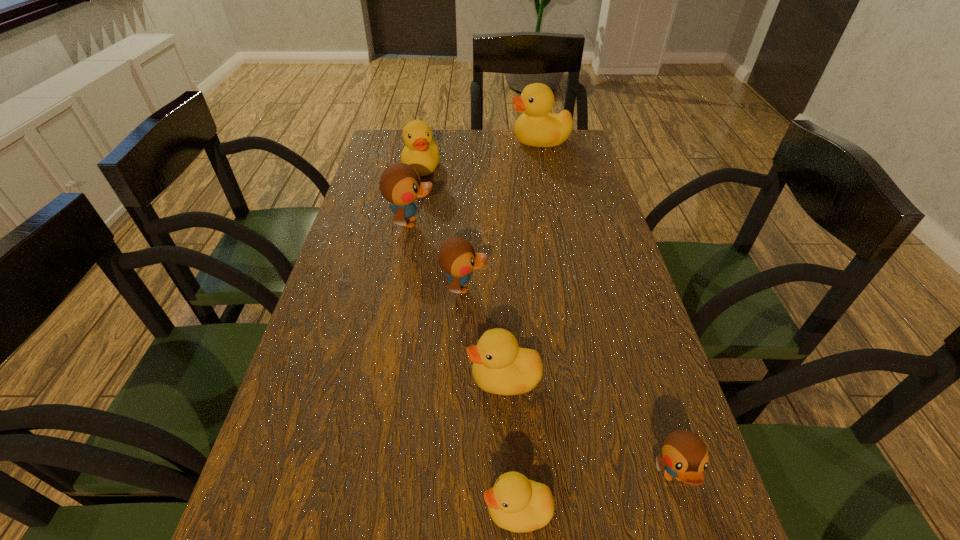
Find the location of `vacant space at the right edge`. vacant space at the right edge is located at coordinates [575, 171].

Find the location of a particular element. The height and width of the screenshot is (540, 960). blank region between the farthest yellow duck and the rightmost blue duck is located at coordinates (607, 309).

You are a GUI agent. You are given a task and a screenshot of the screen. Output one action in this format:
    pyautogui.click(x=<x>, y=<y>)
    Task: Click on the free space between the second biggest blue duck and the farthest object
    The width and height of the screenshot is (960, 540).
    Given the screenshot: What is the action you would take?
    pyautogui.click(x=502, y=214)

This screenshot has height=540, width=960. What are the coordinates of `vacant space that is in between the farthest duck and the smallest yellow duck` in the screenshot? It's located at (529, 326).

Where is `vacant area between the second nearest blue duck and the second smallest yellow duck`? vacant area between the second nearest blue duck and the second smallest yellow duck is located at coordinates (484, 333).

Where is `unoccupied area between the biggest yellow duck and the third nearest object`? unoccupied area between the biggest yellow duck and the third nearest object is located at coordinates (522, 260).

Where is `unoccupied area between the third farthest object and the second smallest yellow duck`? This screenshot has height=540, width=960. unoccupied area between the third farthest object and the second smallest yellow duck is located at coordinates (458, 301).

The width and height of the screenshot is (960, 540). I want to click on free space that is in between the fourth nearest duck and the nearest yellow duck, so click(x=491, y=399).

Find the location of a particular element. Image resolution: width=960 pixels, height=540 pixels. vacant area that lies between the second farthest object and the smallest blue duck is located at coordinates (547, 322).

Identify the location of free point between the second blue duck from left to right and the rightmost blue duck. (568, 382).